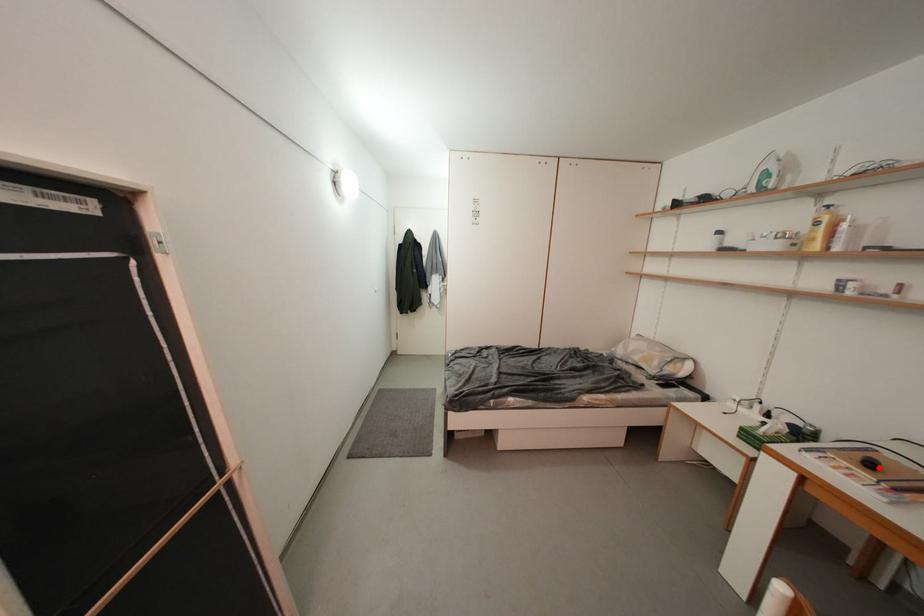
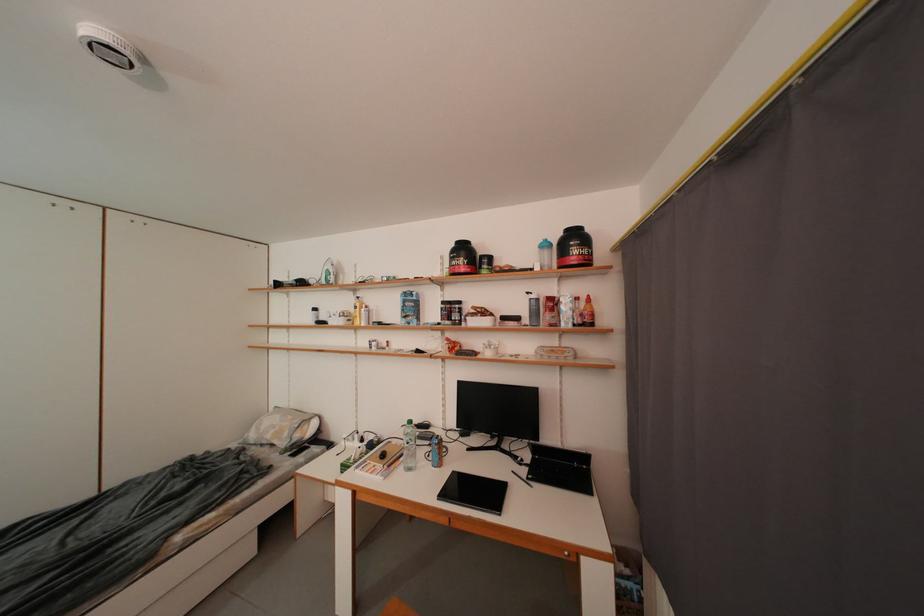
Question: I am providing you with two images of the same scene from different viewpoints. Image1 has a red point marked. In image2, the corresponding 3D location appears at what relative position? Reply with the corresponding letter.

Choices:
 (A) Closer
 (B) Farther

Answer: (B)